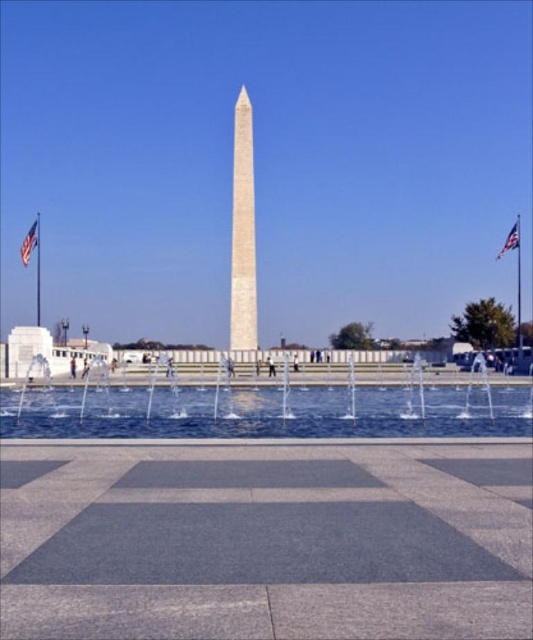
From the picture: Who is taller, white marble obelisk at center or american flag at upper right?

Standing taller between the two is white marble obelisk at center.

What are the coordinates of `white marble obelisk at center` in the screenshot? It's located at (243, 230).

Between point (238, 168) and point (518, 237), which one is positioned behind?

The point (238, 168) is behind.

In order to click on white marble obelisk at center in this screenshot , I will do `click(243, 230)`.

What do you see at coordinates (243, 230) in the screenshot?
I see `white marble obelisk at center` at bounding box center [243, 230].

Who is shorter, white marble obelisk at center or red fabric flag at upper left?

red fabric flag at upper left is shorter.

Which is in front, point (243, 246) or point (34, 230)?

Point (243, 246)

I want to click on white marble obelisk at center, so click(x=243, y=230).

Can you confirm if clear water at center is positioned below white marble obelisk at center?

Yes, clear water at center is below white marble obelisk at center.

Who is more forward, (46, 396) or (238, 259)?

Point (46, 396)

Where is `clear water at center`? The height and width of the screenshot is (640, 533). clear water at center is located at coordinates (264, 412).

At what (x,y) coordinates should I click in order to perform the action: click on clear water at center. Please return your answer as a coordinate pair (x, y). The width and height of the screenshot is (533, 640). Looking at the image, I should click on (264, 412).